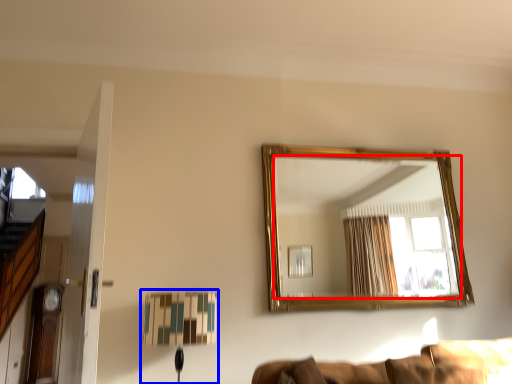
Question: Which object is further to the camera taking this photo, mirror (highlighted by a red box) or table lamp (highlighted by a blue box)?

Choices:
 (A) mirror
 (B) table lamp

Answer: (A)